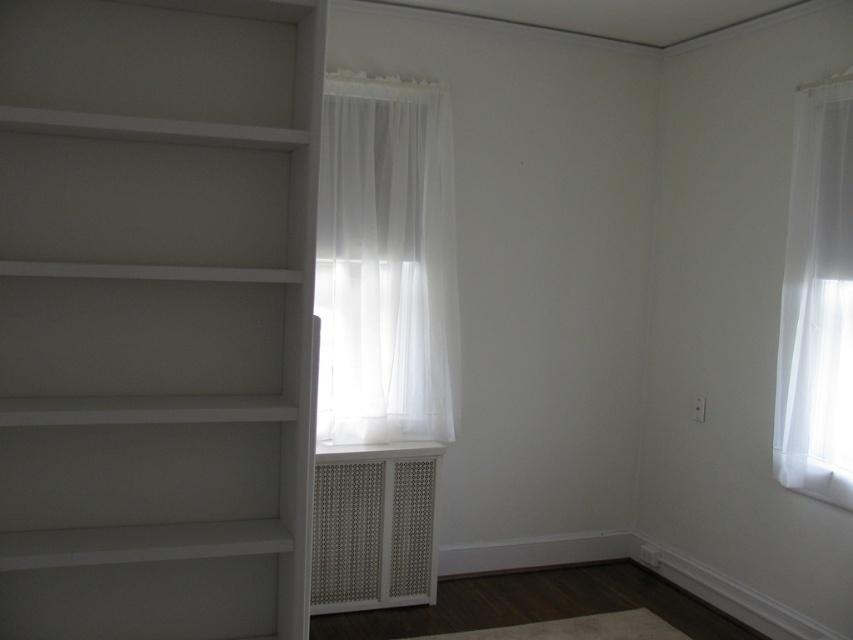
You are standing in the minimalist room and want to place a small potted plant between the two points marked as point (300, 45) and point (412, 518). Which point should the plant be closer to so it is positioned in front of the other point?

The plant should be placed closer to point (300, 45) because it is in front of point (412, 518).

You are an interior designer assessing the room layout. You need to determine if the sheer white curtain at right can be moved to cover the white textured vent at center without overlapping. Can this be done based on their sizes?

The sheer white curtain at right is smaller than the white textured vent at center, so it cannot fully cover the vent without overlapping if placed directly over it.

You are trying to hang a picture frame between the white painted wood bookshelf at left and the sheer white curtain at center. Since the bookshelf is under the curtain, can you hang the frame above the bookshelf but below the curtain?

Yes, you can hang the picture frame above the white painted wood bookshelf at left but below the sheer white curtain at center since the bookshelf is positioned under the curtain.